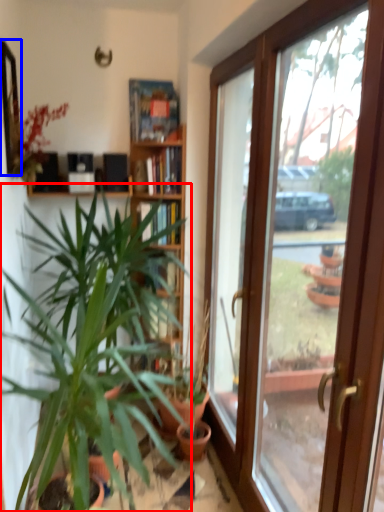
Question: Among these objects, which one is farthest to the camera, houseplant (highlighted by a red box) or mirror (highlighted by a blue box)?

Choices:
 (A) houseplant
 (B) mirror

Answer: (A)